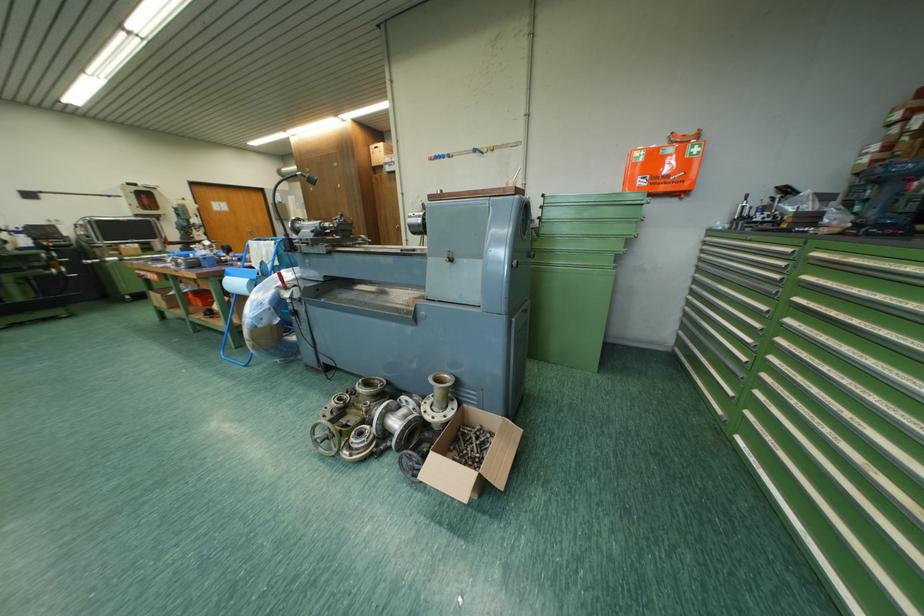
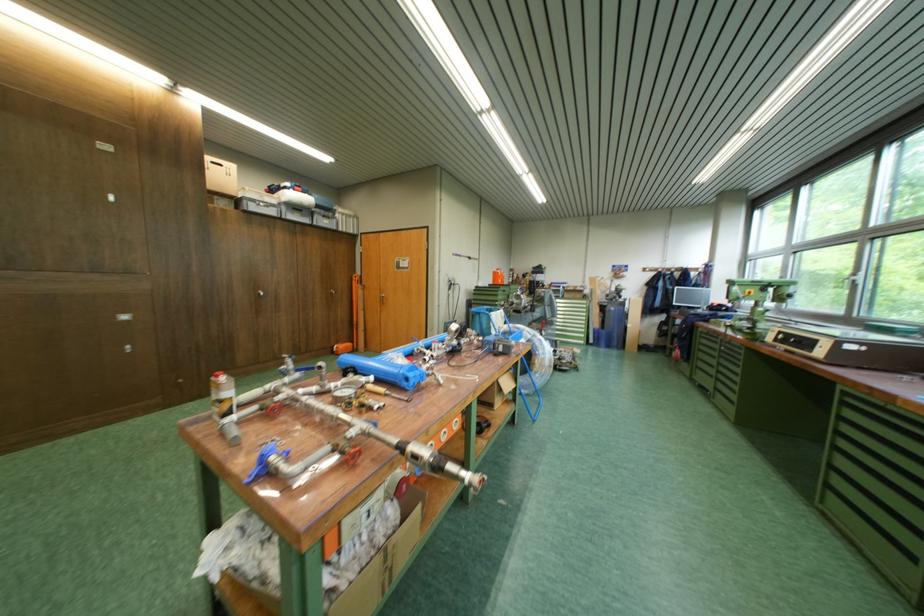
The point at (x=345, y=168) is marked in the first image. Where is the corresponding point in the second image?

(110, 150)